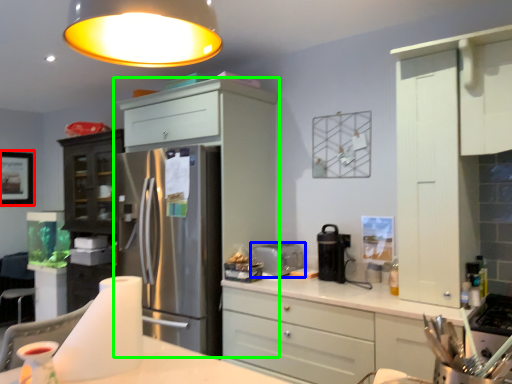
Question: Which is farther away from picture frame (highlighted by a red box)? toaster (highlighted by a blue box) or cabinetry (highlighted by a green box)?

Choices:
 (A) toaster
 (B) cabinetry

Answer: (A)